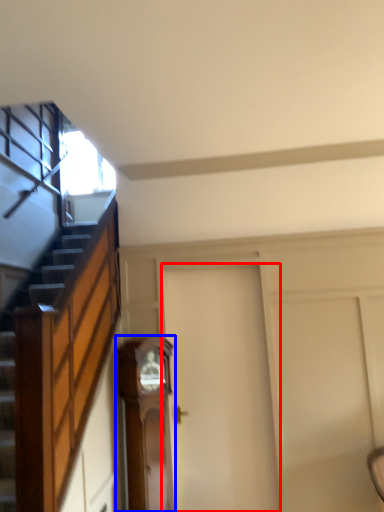
Question: Which point is further to the camera, door (highlighted by a red box) or furniture (highlighted by a blue box)?

Choices:
 (A) door
 (B) furniture

Answer: (A)